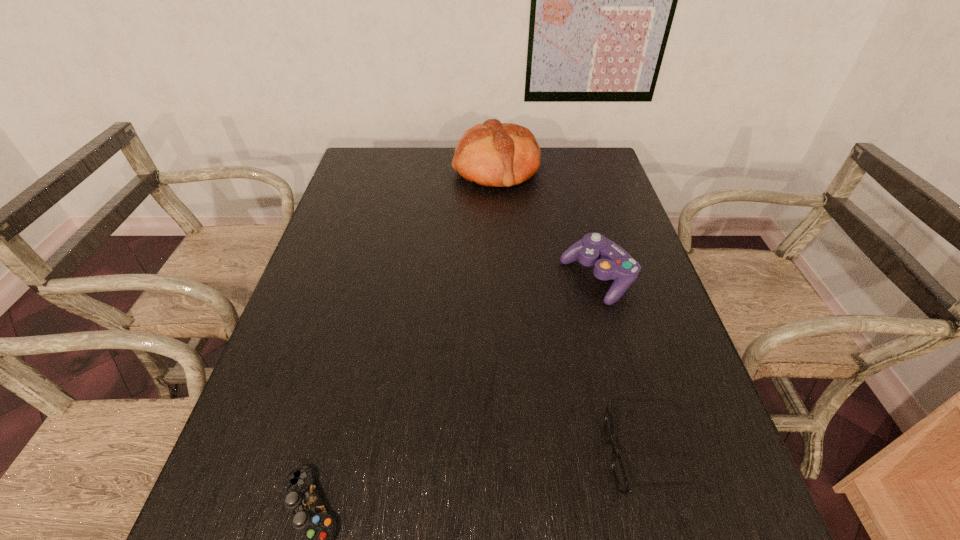
Locate an element on the screen. This screenshot has height=540, width=960. bread is located at coordinates (495, 154).

The width and height of the screenshot is (960, 540). What are the coordinates of `the farthest object` in the screenshot? It's located at 495,154.

The image size is (960, 540). In order to click on the second tallest object in this screenshot , I will do `click(611, 262)`.

Locate an element on the screen. the farther control is located at coordinates (611, 262).

At what (x,y) coordinates should I click in order to perform the action: click on spectacles. Please return your answer as a coordinate pair (x, y). The height and width of the screenshot is (540, 960). Looking at the image, I should click on (620, 476).

Image resolution: width=960 pixels, height=540 pixels. Find the location of `vacant area located 0.300m on the front of the tallest object`. vacant area located 0.300m on the front of the tallest object is located at coordinates (501, 257).

This screenshot has width=960, height=540. Find the location of `vacant space positioned on the left of the taller control`. vacant space positioned on the left of the taller control is located at coordinates (519, 279).

At what (x,y) coordinates should I click in order to perform the action: click on vacant space located 0.100m on the front-facing side of the spectacles. Please return your answer as a coordinate pair (x, y). The image size is (960, 540). Looking at the image, I should click on (551, 455).

Identify the location of blank space located on the front-facing side of the spectacles. The image size is (960, 540). (485, 455).

This screenshot has width=960, height=540. Find the location of `free space located 0.340m on the front-facing side of the spectacles`. free space located 0.340m on the front-facing side of the spectacles is located at coordinates (419, 455).